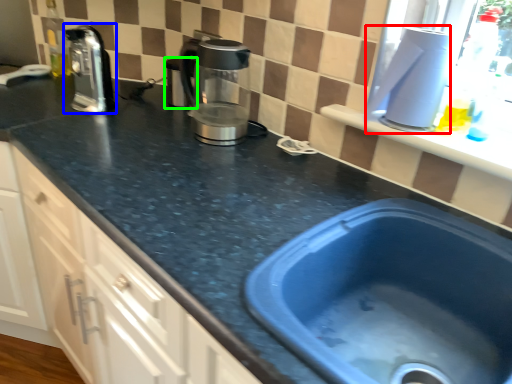
Question: Estimate the real-world distances between objects in this image. Which object is farther from appliance (highlighted by a red box), coffeepot (highlighted by a blue box) or appliance (highlighted by a green box)?

Choices:
 (A) coffeepot
 (B) appliance

Answer: (A)